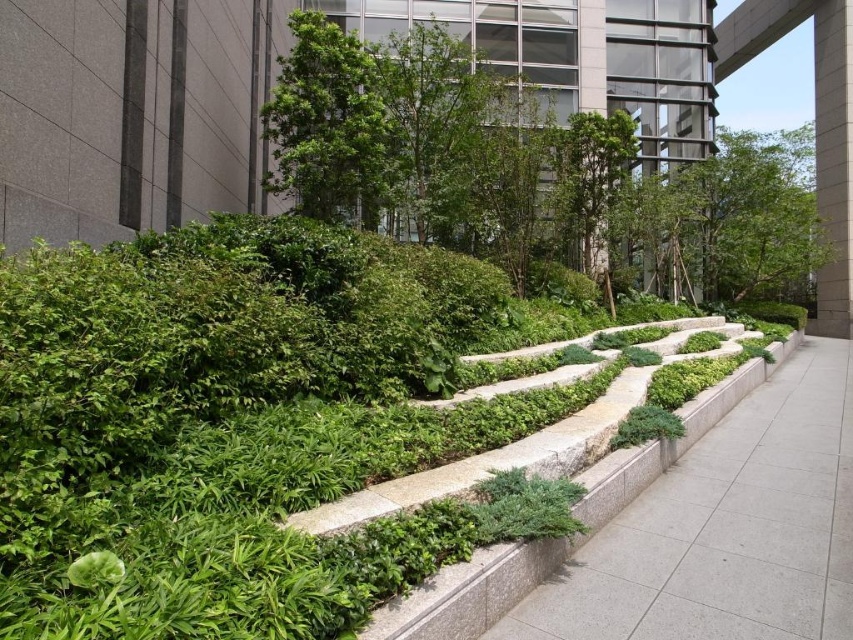
Question: Which object is closer to the camera taking this photo?

Choices:
 (A) green leafy tree at upper center
 (B) green leafy tree at center

Answer: (B)

Question: Where is green leafy tree at upper center located in relation to green leafy tree at center in the image?

Choices:
 (A) above
 (B) below

Answer: (A)

Question: Can you confirm if green leafy tree at upper center is positioned to the left of green leafy tree at center?

Choices:
 (A) yes
 (B) no

Answer: (B)

Question: Does green leafy tree at upper center have a smaller size compared to green leafy tree at center?

Choices:
 (A) no
 (B) yes

Answer: (A)

Question: Estimate the real-world distances between objects in this image. Which object is closer to the gray concrete pavement at center?

Choices:
 (A) green leafy tree at center
 (B) green leafy tree at upper center

Answer: (A)

Question: Which object is positioned farthest from the gray concrete pavement at center?

Choices:
 (A) green leafy tree at center
 (B) green leafy tree at upper center

Answer: (B)